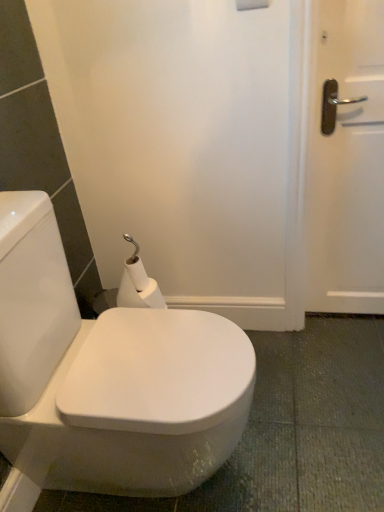
Question: Is white glossy bidet at center looking in the opposite direction of white matte toilet paper at center?

Choices:
 (A) yes
 (B) no

Answer: (B)

Question: Is white glossy bidet at center wider than white matte toilet paper at center?

Choices:
 (A) yes
 (B) no

Answer: (A)

Question: Would you consider white glossy bidet at center to be distant from white matte toilet paper at center?

Choices:
 (A) no
 (B) yes

Answer: (A)

Question: From a real-world perspective, is white glossy bidet at center physically above white matte toilet paper at center?

Choices:
 (A) yes
 (B) no

Answer: (B)

Question: Is white glossy bidet at center smaller than white matte toilet paper at center?

Choices:
 (A) no
 (B) yes

Answer: (A)

Question: Is white glossy bidet at center to the left of white matte toilet paper at center from the viewer's perspective?

Choices:
 (A) no
 (B) yes

Answer: (A)

Question: Is the position of white matte toilet paper at center more distant than that of white glossy bidet at center?

Choices:
 (A) yes
 (B) no

Answer: (A)

Question: Does white matte toilet paper at center turn towards white glossy bidet at center?

Choices:
 (A) no
 (B) yes

Answer: (B)

Question: From a real-world perspective, is white matte toilet paper at center under white glossy bidet at center?

Choices:
 (A) yes
 (B) no

Answer: (B)

Question: Is white matte toilet paper at center outside of white glossy bidet at center?

Choices:
 (A) no
 (B) yes

Answer: (B)

Question: Is white matte toilet paper at center facing away from white glossy bidet at center?

Choices:
 (A) yes
 (B) no

Answer: (B)

Question: Is white matte toilet paper at center not near white glossy bidet at center?

Choices:
 (A) no
 (B) yes

Answer: (A)

Question: From their relative heights in the image, would you say white glossy bidet at center is taller or shorter than white matte toilet paper at center?

Choices:
 (A) tall
 (B) short

Answer: (A)